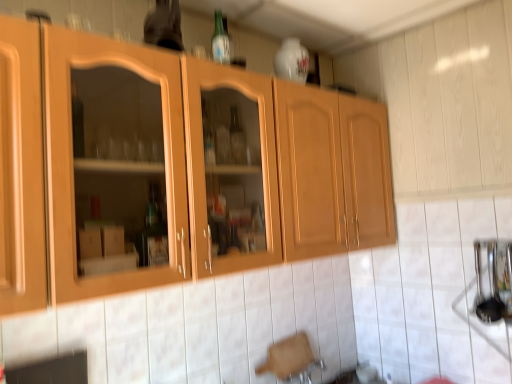
Question: Relative to wooden cabinet at center, is matte glass bottle at upper center in front or behind?

Choices:
 (A) front
 (B) behind

Answer: (B)

Question: From the image's perspective, is matte glass bottle at upper center positioned above or below wooden cabinet at center?

Choices:
 (A) below
 (B) above

Answer: (B)

Question: Which is correct: matte glass bottle at upper center is inside wooden cabinet at center, or outside of it?

Choices:
 (A) inside
 (B) outside

Answer: (B)

Question: Considering the positions of wooden cabinet at center and matte glass bottle at upper center in the image, is wooden cabinet at center taller or shorter than matte glass bottle at upper center?

Choices:
 (A) short
 (B) tall

Answer: (B)

Question: Is wooden cabinet at center bigger or smaller than matte glass bottle at upper center?

Choices:
 (A) small
 (B) big

Answer: (B)

Question: Is wooden cabinet at center spatially inside matte glass bottle at upper center, or outside of it?

Choices:
 (A) outside
 (B) inside

Answer: (A)

Question: Considering the positions of point (49, 147) and point (158, 0), is point (49, 147) closer or farther from the camera than point (158, 0)?

Choices:
 (A) closer
 (B) farther

Answer: (A)